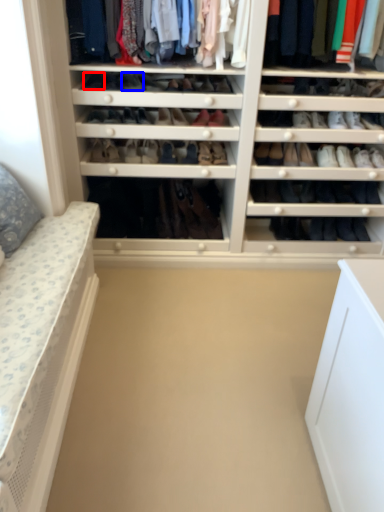
Question: Which of the following is the closest to the observer, shoe (highlighted by a red box) or shoe (highlighted by a blue box)?

Choices:
 (A) shoe
 (B) shoe

Answer: (A)